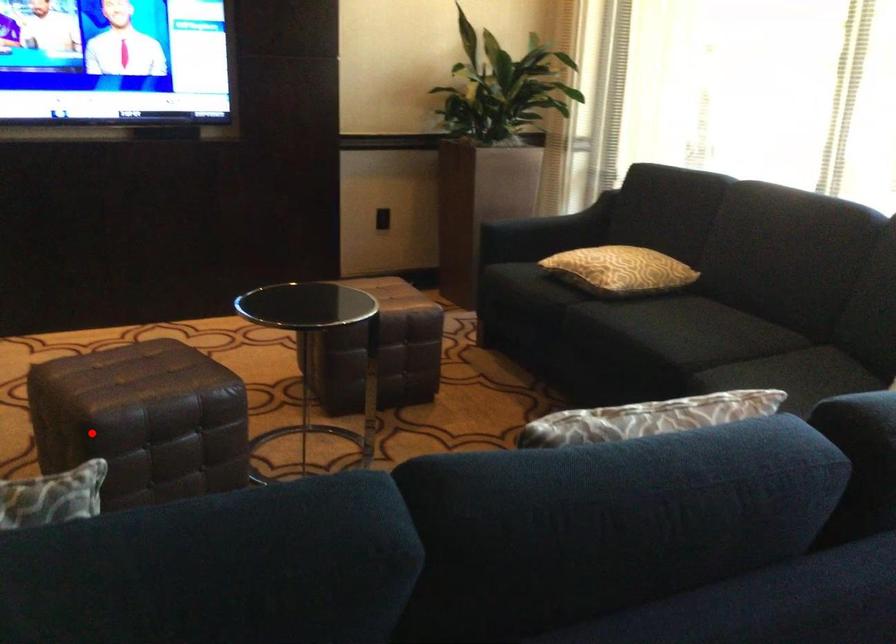
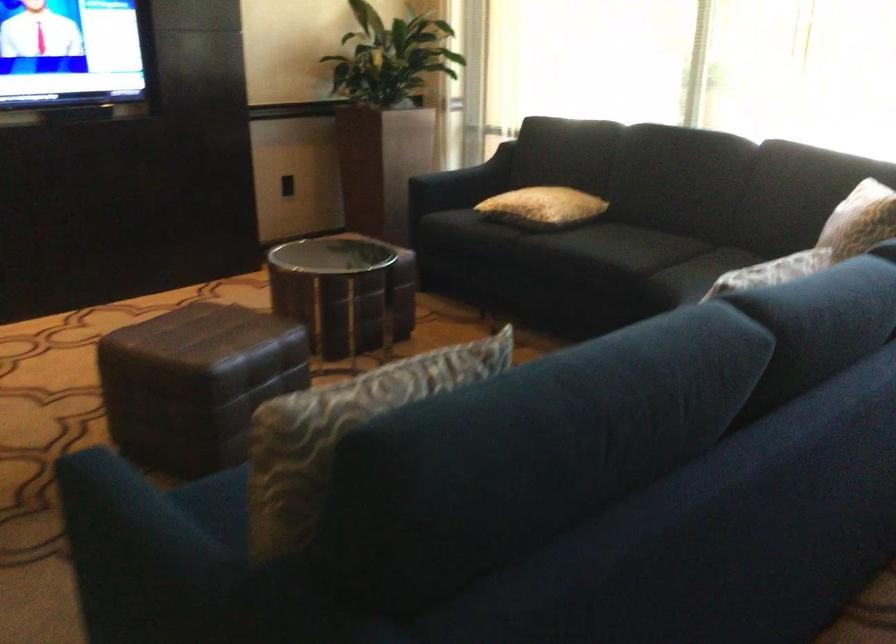
Locate, in the second image, the point that corresponds to the highlighted location in the first image.

(195, 383)